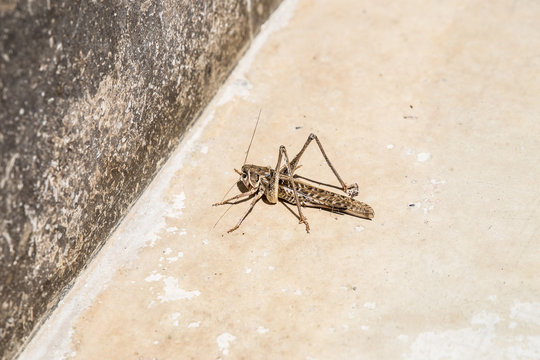
Locate an element on the screen. The image size is (540, 360). floor in front of bug is located at coordinates (206, 170).